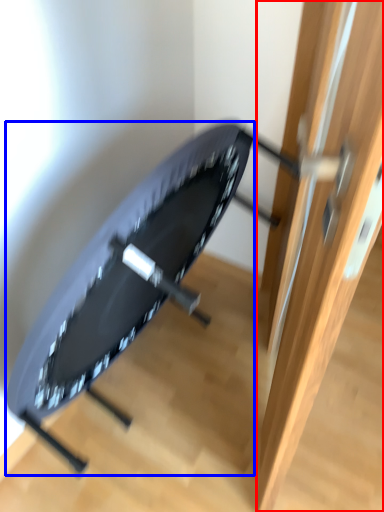
Question: Among these objects, which one is farthest to the camera, door (highlighted by a red box) or swivel chair (highlighted by a blue box)?

Choices:
 (A) door
 (B) swivel chair

Answer: (B)